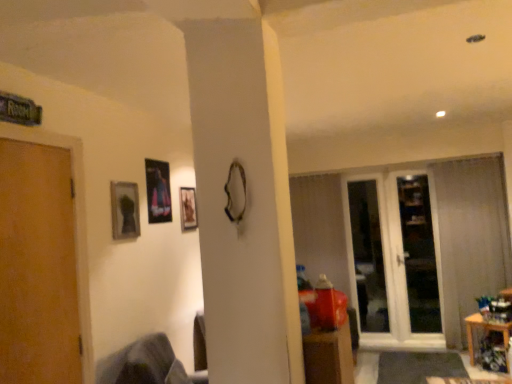
Question: Is dark gray fabric swivel chair at lower left shorter than matte glass picture frame at upper left, which ranks as the first picture frame in left-to-right order?

Choices:
 (A) yes
 (B) no

Answer: (B)

Question: Is matte glass picture frame at upper left, which ranks as the first picture frame in left-to-right order, inside dark gray fabric swivel chair at lower left?

Choices:
 (A) no
 (B) yes

Answer: (A)

Question: Is dark gray fabric swivel chair at lower left positioned with its back to matte glass picture frame at upper left, which appears as the 3th picture frame when viewed from the back?

Choices:
 (A) no
 (B) yes

Answer: (A)

Question: Considering the relative sizes of dark gray fabric swivel chair at lower left and matte glass picture frame at upper left, which ranks as the first picture frame in left-to-right order, in the image provided, is dark gray fabric swivel chair at lower left taller than matte glass picture frame at upper left, which ranks as the first picture frame in left-to-right order,?

Choices:
 (A) yes
 (B) no

Answer: (A)

Question: Considering the relative sizes of dark gray fabric swivel chair at lower left and matte glass picture frame at upper left, which appears as the 3th picture frame when viewed from the back, in the image provided, is dark gray fabric swivel chair at lower left thinner than matte glass picture frame at upper left, which appears as the 3th picture frame when viewed from the back,?

Choices:
 (A) no
 (B) yes

Answer: (A)

Question: From a real-world perspective, is dark gray fabric swivel chair at lower left on top of matte glass picture frame at upper left, which appears as the 3th picture frame when viewed from the back?

Choices:
 (A) yes
 (B) no

Answer: (B)

Question: From the image's perspective, would you say wooden door at left is positioned over metallic glossy picture frame at upper center, arranged as the second picture frame when viewed from the back?

Choices:
 (A) yes
 (B) no

Answer: (B)

Question: Is wooden door at left not within metallic glossy picture frame at upper center, which ranks as the second picture frame in front-to-back order?

Choices:
 (A) no
 (B) yes

Answer: (B)

Question: Is wooden door at left shorter than metallic glossy picture frame at upper center, the 2th picture frame when ordered from left to right?

Choices:
 (A) no
 (B) yes

Answer: (A)

Question: Is wooden door at left facing away from metallic glossy picture frame at upper center, which ranks as the second picture frame in front-to-back order?

Choices:
 (A) no
 (B) yes

Answer: (A)

Question: Can you confirm if wooden door at left is wider than metallic glossy picture frame at upper center, which ranks as the second picture frame in front-to-back order?

Choices:
 (A) yes
 (B) no

Answer: (A)

Question: Does wooden door at left have a lesser width compared to metallic glossy picture frame at upper center, the 2th picture frame when ordered from left to right?

Choices:
 (A) no
 (B) yes

Answer: (A)

Question: From the image's perspective, is transparent glass door at right under dark gray fabric swivel chair at lower left?

Choices:
 (A) no
 (B) yes

Answer: (A)